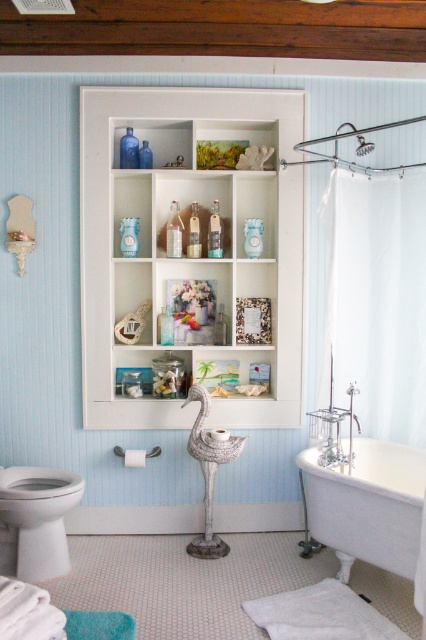
You are standing in the bathroom and want to reach both points. Which point, point [94,248] or point [367,472], will you need to stretch your arm less to touch?

Point [94,248] is further to the camera than point [367,472], so you will need to stretch your arm less to touch point [94,248].

You are standing in the bathroom and want to hang a new towel hook on the wall. The hook requires a minimum of 15 cm of clear space around it to avoid damaging nearby items. Based on the current layout, where can you safely install the hook without interfering with the white fabric shower curtain at right?

The white fabric shower curtain at right is located at coordinates (376,300). To ensure the hook has 15 cm of clear space around it, you should install it at least 15 cm away from this point in any direction.

You are standing at a point in the bathroom and want to reach the white shelving unit mounted on the wall. The point where you are standing is marked as point (100,244). Can you estimate whether you are closer to the shelving unit than 3 meters?

The distance between point (100,244) and the shelving unit is 3.15 meters, so you are slightly farther than 3 meters away from the shelving unit.